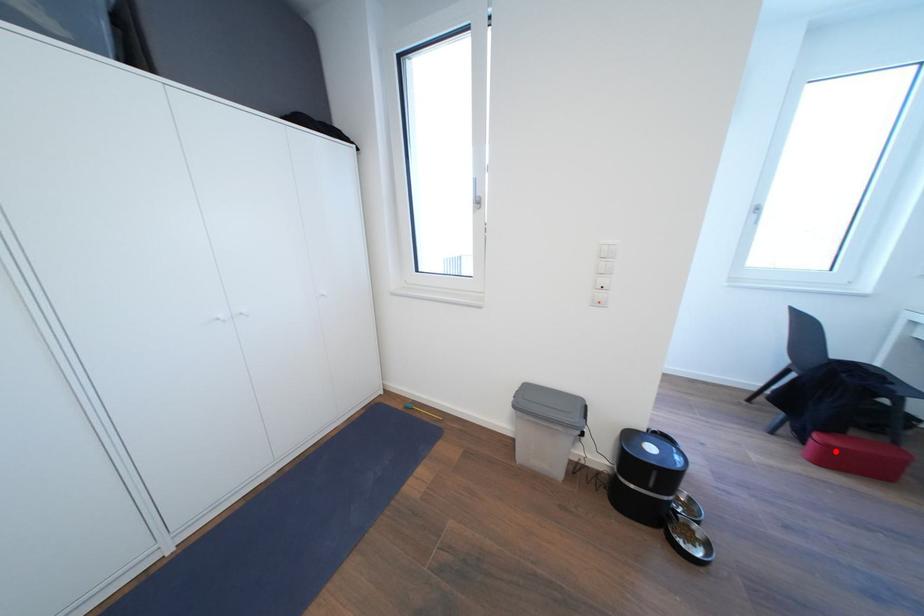
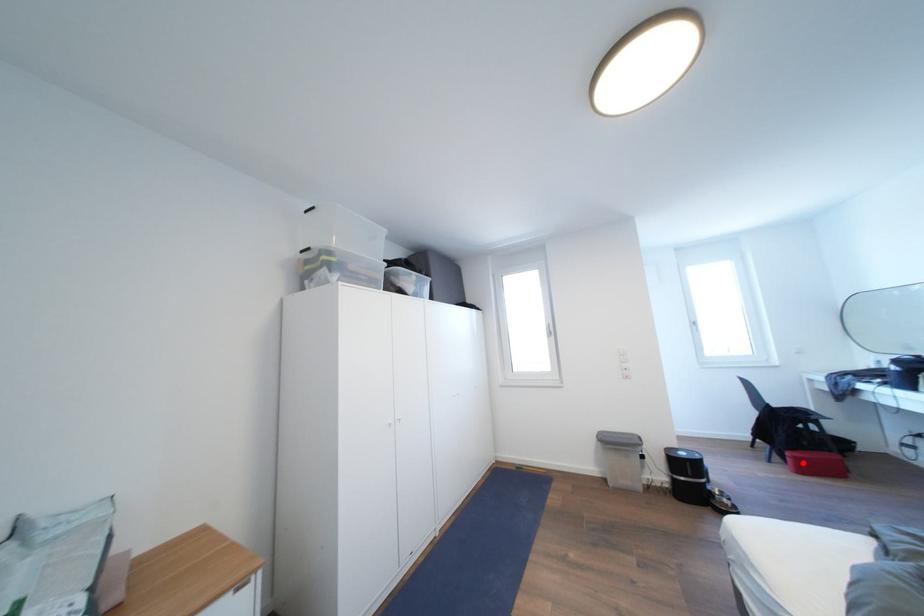
I am providing you with two images of the same scene from different viewpoints. A red point is marked on the first image and another point is marked on the second image. Does the point marked in image1 correspond to the same location as the one in image2?

Yes